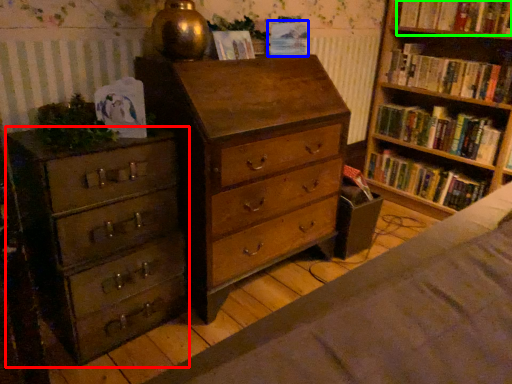
Question: Based on their relative distances, which object is nearer to chest of drawers (highlighted by a red box)? Choose from paperback book (highlighted by a blue box) and book (highlighted by a green box).

Choices:
 (A) paperback book
 (B) book

Answer: (A)